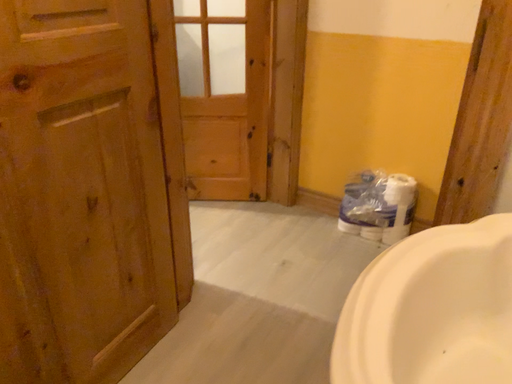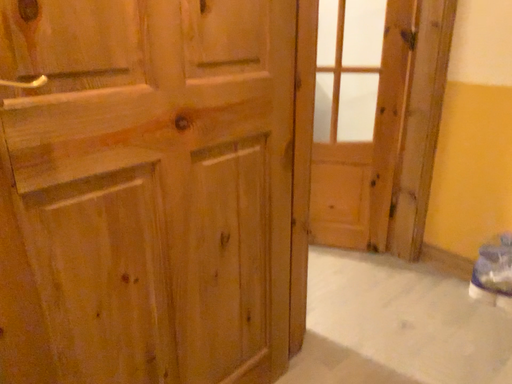
Question: How did the camera likely rotate when shooting the video?

Choices:
 (A) rotated right
 (B) rotated left

Answer: (B)